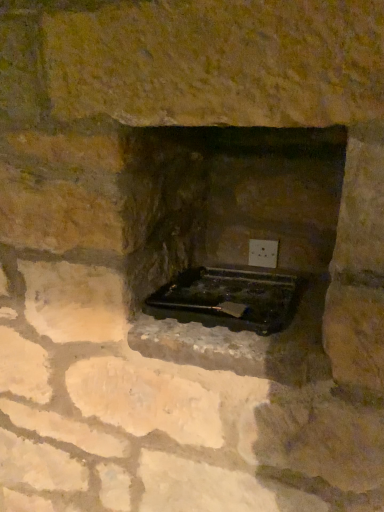
The height and width of the screenshot is (512, 384). What do you see at coordinates (263, 253) in the screenshot?
I see `white plastic electric outlet at center` at bounding box center [263, 253].

I want to click on white plastic electric outlet at center, so click(x=263, y=253).

The height and width of the screenshot is (512, 384). What do you see at coordinates (229, 298) in the screenshot?
I see `black plastic tray at center` at bounding box center [229, 298].

In order to click on black plastic tray at center in this screenshot , I will do 229,298.

Find the location of `white plastic electric outlet at center`. white plastic electric outlet at center is located at coordinates (263, 253).

Visually, is black plastic tray at center positioned to the left or to the right of white plastic electric outlet at center?

Based on their positions, black plastic tray at center is located to the left of white plastic electric outlet at center.

Is black plastic tray at center positioned before white plastic electric outlet at center?

Yes, it is.

Does point (283, 285) appear closer or farther from the camera than point (265, 266)?

Point (283, 285) is positioned closer to the camera compared to point (265, 266).

From the image's perspective, which is below, black plastic tray at center or white plastic electric outlet at center?

black plastic tray at center is shown below in the image.

From a real-world perspective, is black plastic tray at center located beneath white plastic electric outlet at center?

Yes.

Considering the sizes of objects black plastic tray at center and white plastic electric outlet at center in the image provided, who is wider, black plastic tray at center or white plastic electric outlet at center?

Wider between the two is black plastic tray at center.

In terms of height, does black plastic tray at center look taller or shorter compared to white plastic electric outlet at center?

Considering their sizes, black plastic tray at center has less height than white plastic electric outlet at center.

Considering the sizes of objects black plastic tray at center and white plastic electric outlet at center in the image provided, who is bigger, black plastic tray at center or white plastic electric outlet at center?

black plastic tray at center is bigger.

Is black plastic tray at center not within white plastic electric outlet at center?

Yes.

Are black plastic tray at center and white plastic electric outlet at center located far from each other?

No, there isn't a large distance between black plastic tray at center and white plastic electric outlet at center.

Is black plastic tray at center aimed at white plastic electric outlet at center?

No, black plastic tray at center is not turned towards white plastic electric outlet at center.

What's the angular difference between black plastic tray at center and white plastic electric outlet at center's facing directions?

black plastic tray at center and white plastic electric outlet at center are facing 0.00297 degrees away from each other.

Where is `electric outlet behind the black plastic tray at center`? The width and height of the screenshot is (384, 512). electric outlet behind the black plastic tray at center is located at coordinates (263, 253).

In the scene shown: Which is more to the left, white plastic electric outlet at center or black plastic tray at center?

black plastic tray at center is more to the left.

From the picture: Is the depth of white plastic electric outlet at center greater than that of black plastic tray at center?

That is True.

Is point (275, 258) positioned behind point (203, 291)?

Yes, it is behind point (203, 291).

From the image's perspective, is white plastic electric outlet at center positioned above or below black plastic tray at center?

From the image's perspective, white plastic electric outlet at center appears above black plastic tray at center.

From a real-world perspective, is white plastic electric outlet at center positioned under black plastic tray at center based on gravity?

No, from a real-world perspective, white plastic electric outlet at center is not under black plastic tray at center.

From the picture: Can you confirm if white plastic electric outlet at center is thinner than black plastic tray at center?

Yes.

Looking at this image, is white plastic electric outlet at center taller or shorter than black plastic tray at center?

white plastic electric outlet at center is taller than black plastic tray at center.

Which of these two, white plastic electric outlet at center or black plastic tray at center, is bigger?

black plastic tray at center.

Is white plastic electric outlet at center outside of black plastic tray at center?

white plastic electric outlet at center lies outside black plastic tray at center's area.

Is white plastic electric outlet at center next to black plastic tray at center?

No, white plastic electric outlet at center is not next to black plastic tray at center.

Could you tell me if white plastic electric outlet at center is turned towards black plastic tray at center?

Yes, white plastic electric outlet at center is oriented towards black plastic tray at center.

Locate an element on the screen. Image resolution: width=384 pixels, height=512 pixels. appliance in front of the white plastic electric outlet at center is located at coordinates (229, 298).

Locate an element on the screen. The image size is (384, 512). appliance lying on the left of white plastic electric outlet at center is located at coordinates (229, 298).

Where is `appliance in front of the white plastic electric outlet at center`? This screenshot has width=384, height=512. appliance in front of the white plastic electric outlet at center is located at coordinates pyautogui.click(x=229, y=298).